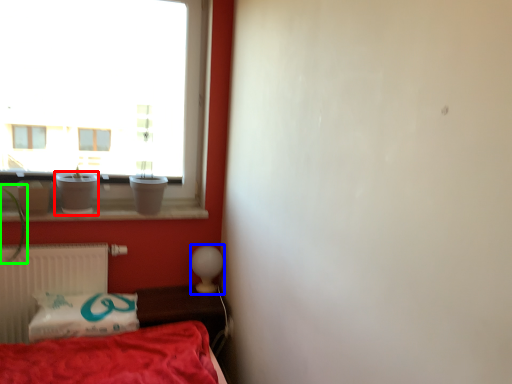
Question: Based on their relative distances, which object is farther from glass vase (highlighted by a red box)? Choose from table lamp (highlighted by a blue box) and plant (highlighted by a green box).

Choices:
 (A) table lamp
 (B) plant

Answer: (A)